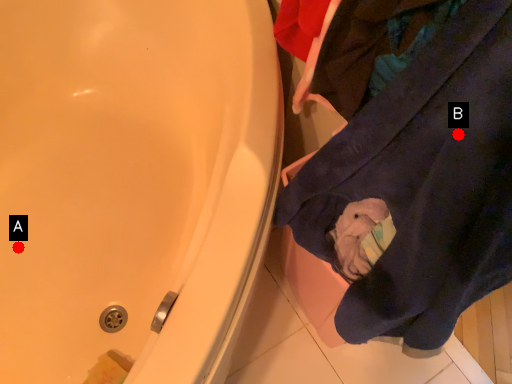
Question: Two points are circled on the image, labeled by A and B beside each circle. Which of the following is the closest to the observer?

Choices:
 (A) A is closer
 (B) B is closer

Answer: (B)